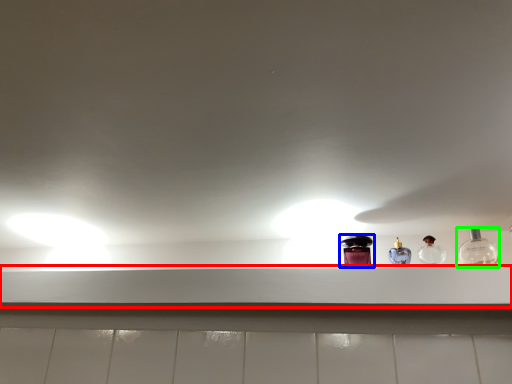
Question: Which is nearer to the window sill (highlighted by a red box)? bottle (highlighted by a blue box) or bottle (highlighted by a green box).

Choices:
 (A) bottle
 (B) bottle

Answer: (A)